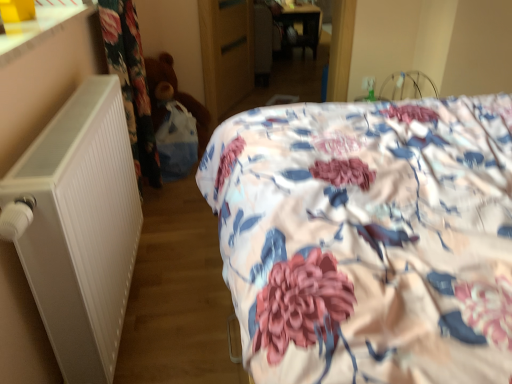
Question: Is white matte radiator at left facing towards wooden wardrobe at center?

Choices:
 (A) no
 (B) yes

Answer: (A)

Question: From a real-world perspective, does white matte radiator at left sit lower than wooden wardrobe at center?

Choices:
 (A) yes
 (B) no

Answer: (B)

Question: Is white matte radiator at left next to wooden wardrobe at center?

Choices:
 (A) no
 (B) yes

Answer: (A)

Question: Is white matte radiator at left not close to wooden wardrobe at center?

Choices:
 (A) yes
 (B) no

Answer: (A)

Question: Can you confirm if white matte radiator at left is wider than wooden wardrobe at center?

Choices:
 (A) yes
 (B) no

Answer: (A)

Question: Is white matte radiator at left bigger or smaller than floral fabric bed at center?

Choices:
 (A) big
 (B) small

Answer: (B)

Question: From a real-world perspective, is white matte radiator at left above or below floral fabric bed at center?

Choices:
 (A) below
 (B) above

Answer: (A)

Question: Considering the positions of white matte radiator at left and floral fabric bed at center in the image, is white matte radiator at left wider or thinner than floral fabric bed at center?

Choices:
 (A) wide
 (B) thin

Answer: (B)

Question: From their relative heights in the image, would you say white matte radiator at left is taller or shorter than floral fabric bed at center?

Choices:
 (A) tall
 (B) short

Answer: (B)

Question: Considering the positions of wooden wardrobe at center and white matte radiator at left in the image, is wooden wardrobe at center wider or thinner than white matte radiator at left?

Choices:
 (A) thin
 (B) wide

Answer: (A)

Question: From the image's perspective, relative to white matte radiator at left, is wooden wardrobe at center above or below?

Choices:
 (A) above
 (B) below

Answer: (A)

Question: Considering the relative positions of wooden wardrobe at center and white matte radiator at left in the image provided, is wooden wardrobe at center to the left or to the right of white matte radiator at left?

Choices:
 (A) right
 (B) left

Answer: (A)

Question: From a real-world perspective, is wooden wardrobe at center positioned above or below white matte radiator at left?

Choices:
 (A) below
 (B) above

Answer: (A)

Question: From the image's perspective, is floral fabric bed at center located above or below wooden wardrobe at center?

Choices:
 (A) above
 (B) below

Answer: (B)

Question: Based on their positions, is floral fabric bed at center located to the left or right of wooden wardrobe at center?

Choices:
 (A) right
 (B) left

Answer: (A)